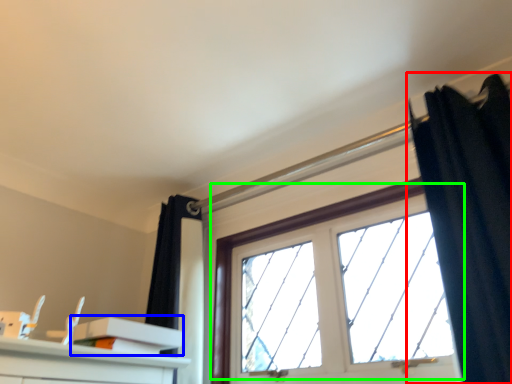
Question: Estimate the real-world distances between objects in this image. Which object is farther from curtain (highlighted by a red box), shelf (highlighted by a blue box) or window (highlighted by a green box)?

Choices:
 (A) shelf
 (B) window

Answer: (A)